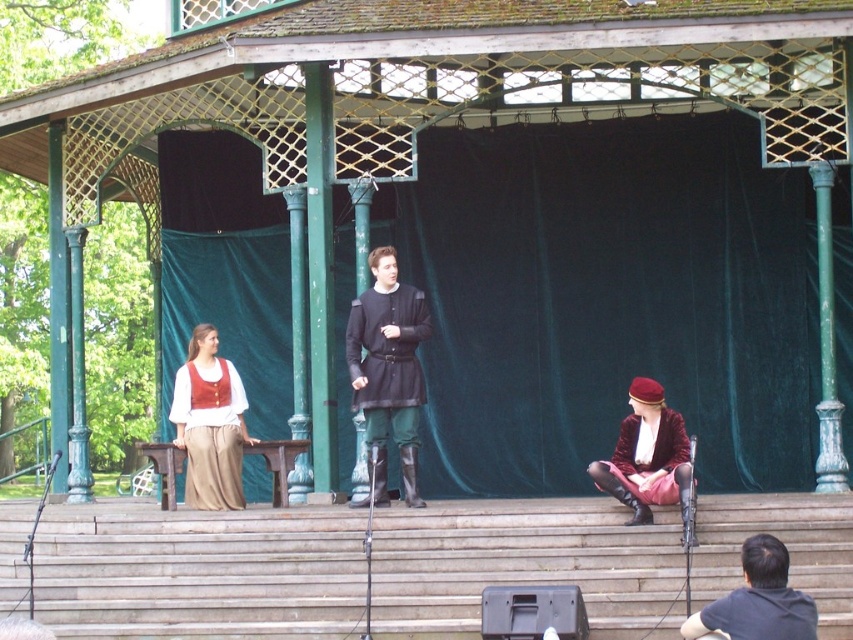
You are an audience member sitting in the front row of the gazebo stage. You need to quickly exit the stage to retrieve your forgotten phone. The wooden stairs at center and the velvet maroon coat at lower right are in your path. Which object do you need to step over or around first?

The velvet maroon coat at lower right must be stepped over or around first because it is smaller than the wooden stairs at center, so it is closer to you in your path.